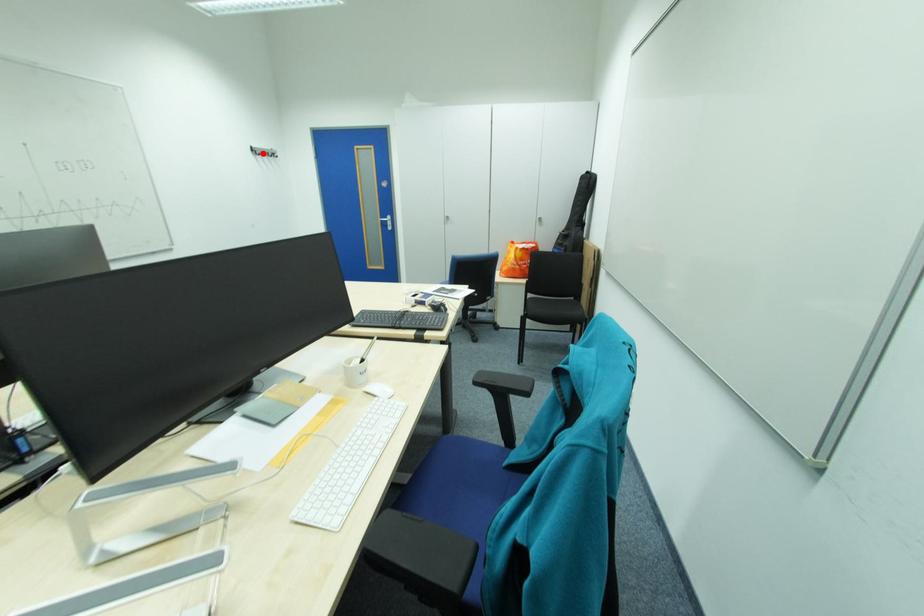
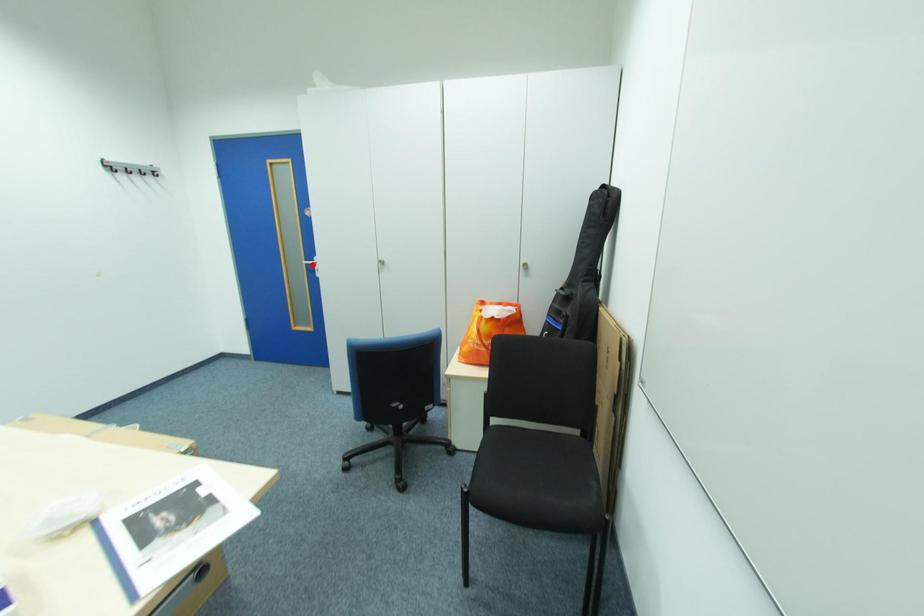
I am providing you with two images of the same scene from different viewpoints. A red point is marked on the first image and another point is marked on the second image. Do the highlighted points in image1 and image2 indicate the same real-world spot?

No